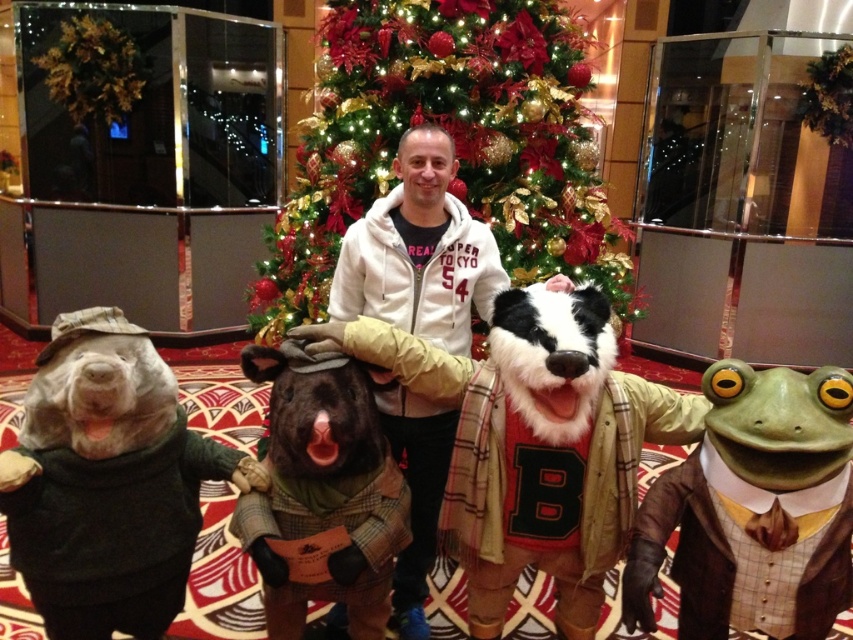
Question: Which object appears closest to the camera in this image?

Choices:
 (A) brown woolen hat at center
 (B) green shiny christmas tree at center
 (C) green plush bear at center

Answer: (C)

Question: Which point is farther from the camera taking this photo?

Choices:
 (A) 166,520
 (B) 634,314
 (C) 260,529
 (D) 498,625

Answer: (B)

Question: Does green plush bear at center have a lesser width compared to fuzzy beige badger at center?

Choices:
 (A) no
 (B) yes

Answer: (B)

Question: Is green plush bear at center below white fleece hoodie at center?

Choices:
 (A) yes
 (B) no

Answer: (A)

Question: Which point appears closest to the camera in this image?

Choices:
 (A) (360, 262)
 (B) (526, 138)

Answer: (A)

Question: Does green shiny christmas tree at center have a larger size compared to brown woolen hat at center?

Choices:
 (A) no
 (B) yes

Answer: (B)